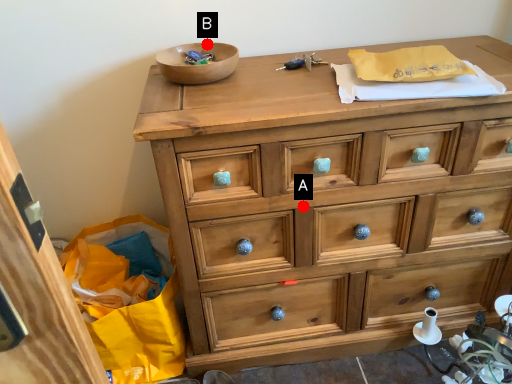
Question: Two points are circled on the image, labeled by A and B beside each circle. Which point is closer to the camera?

Choices:
 (A) A is closer
 (B) B is closer

Answer: (A)